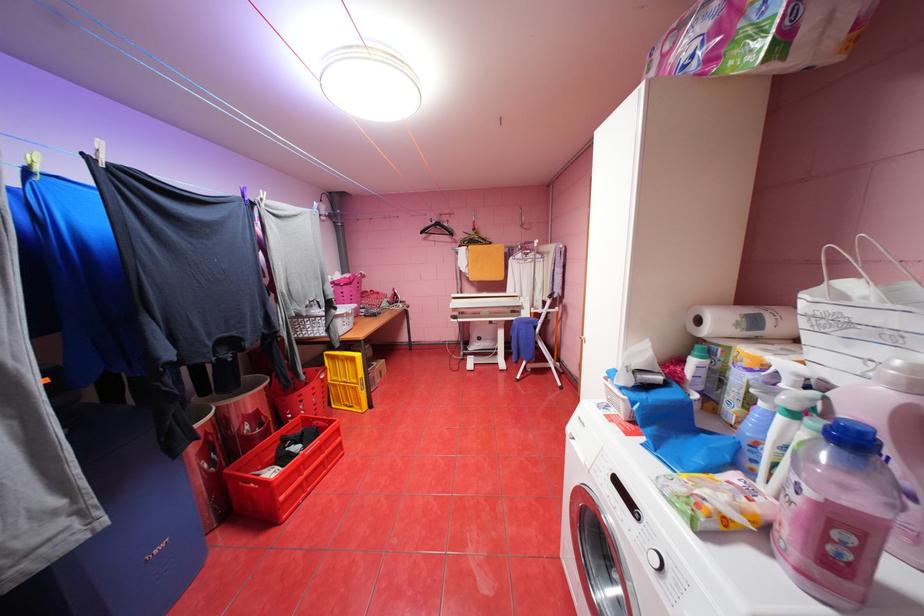
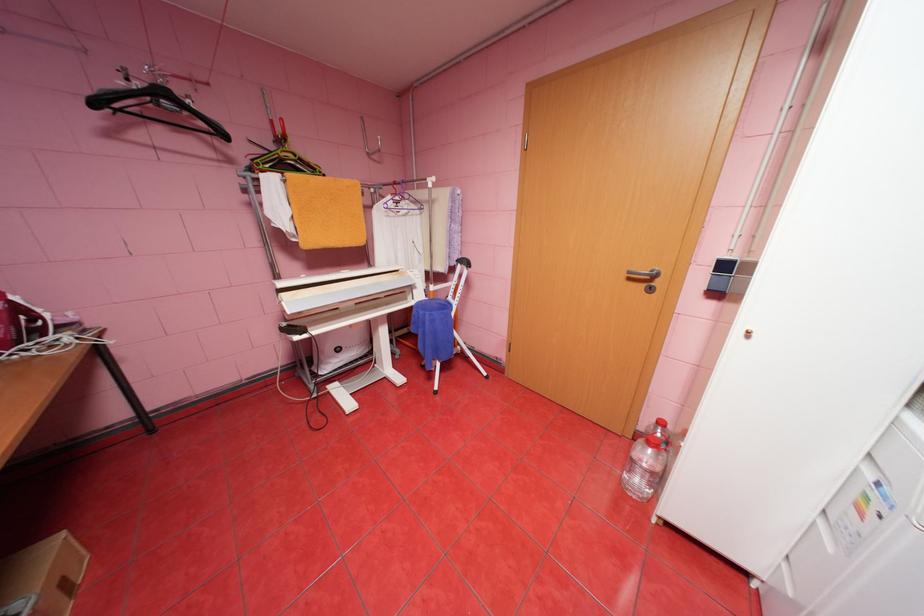
Find the pixel in the second image that matches (431,232) in the first image.

(103, 103)